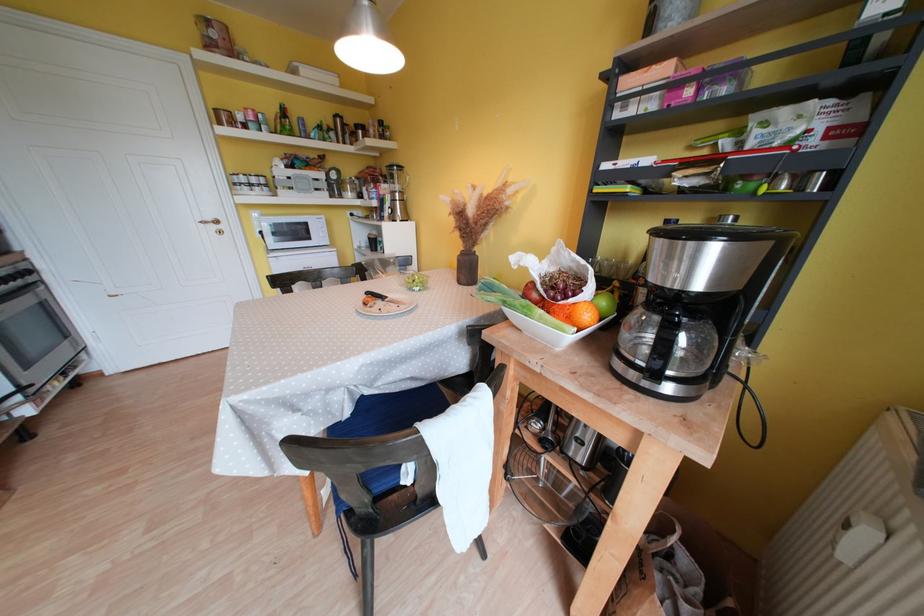
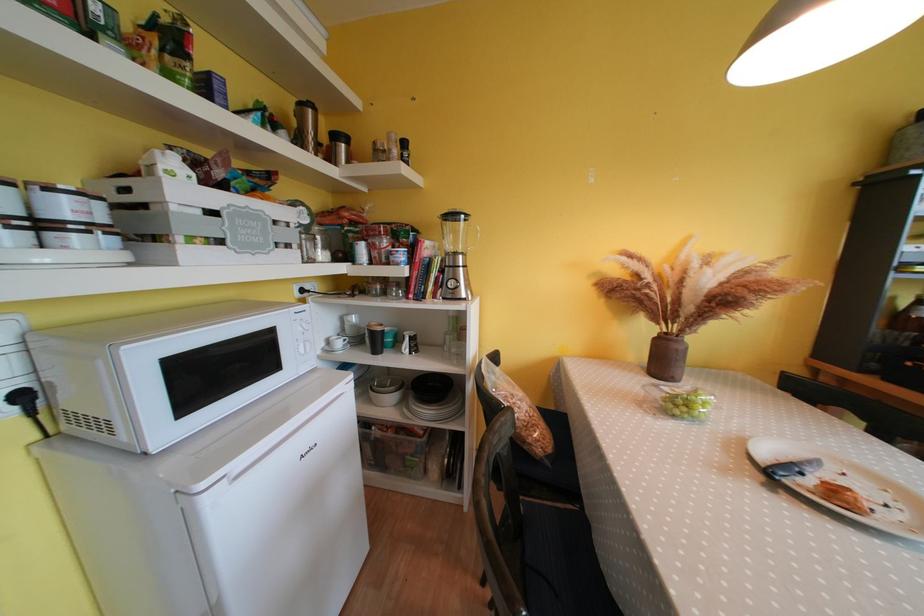
Find the pixel in the second image that matches the point at 362,130 in the first image.

(342, 140)